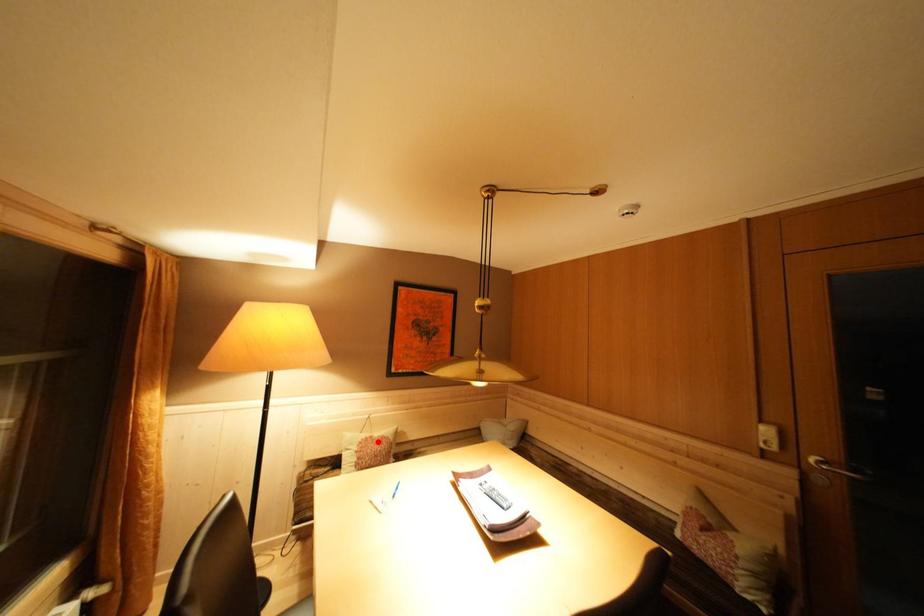
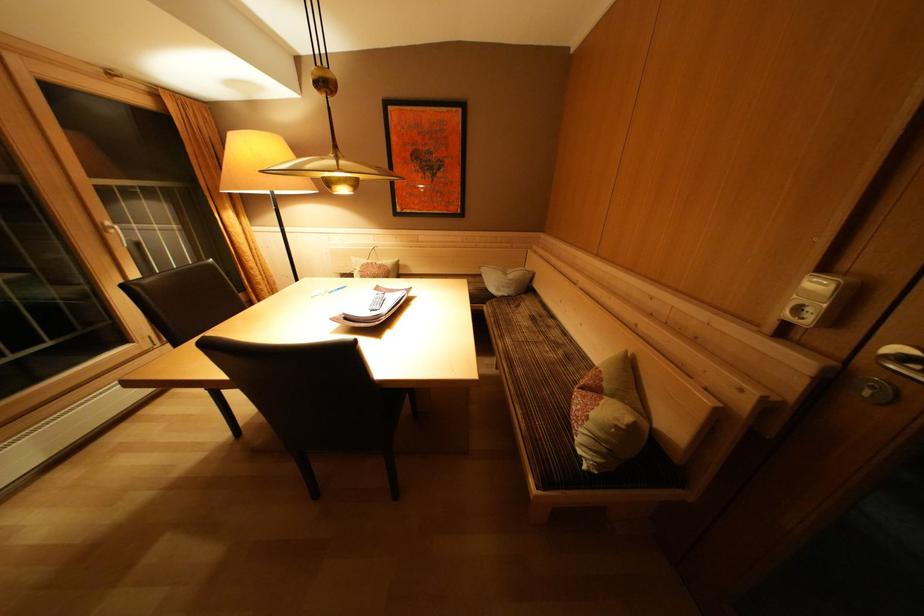
Question: A red point is marked in image1. In image2, is the corresponding 3D point closer to the camera or farther? Reply with the corresponding letter.

Choices:
 (A) The corresponding 3D point is closer.
 (B) The corresponding 3D point is farther.

Answer: (A)